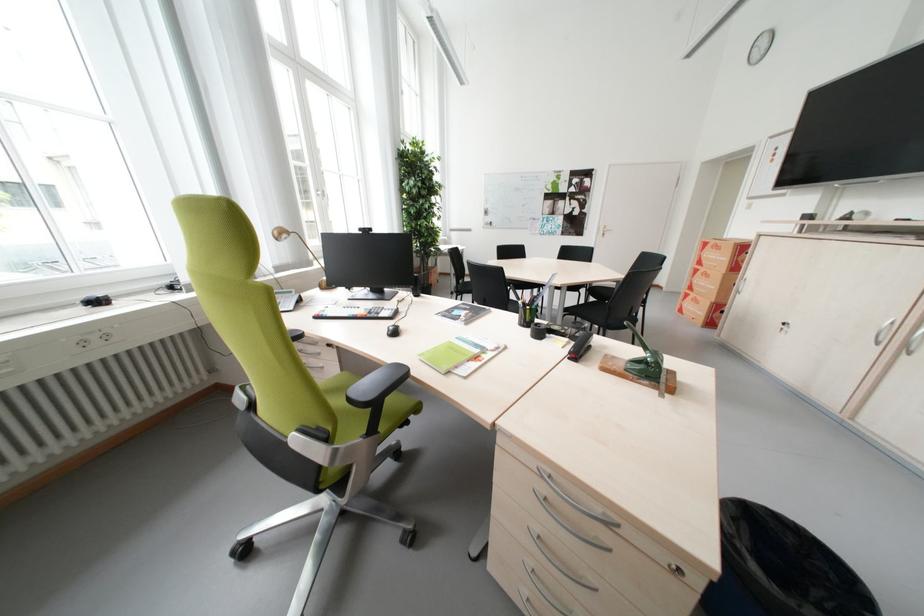
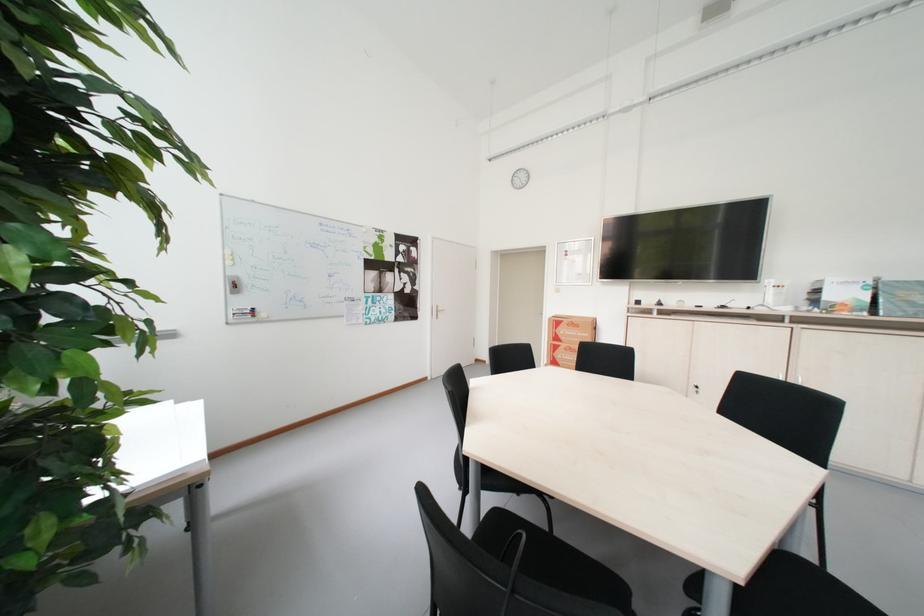
The point at (710, 264) is marked in the first image. Where is the corresponding point in the second image?

(565, 341)